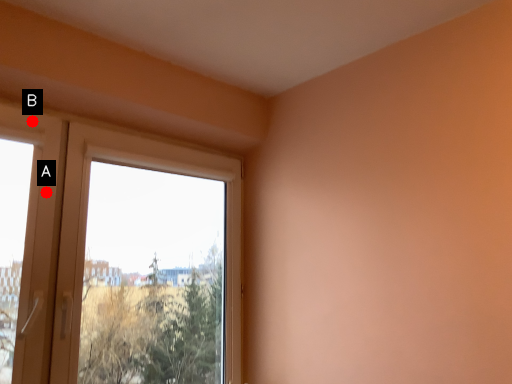
Question: Two points are circled on the image, labeled by A and B beside each circle. Which of the following is the farthest from the observer?

Choices:
 (A) A is further
 (B) B is further

Answer: (B)